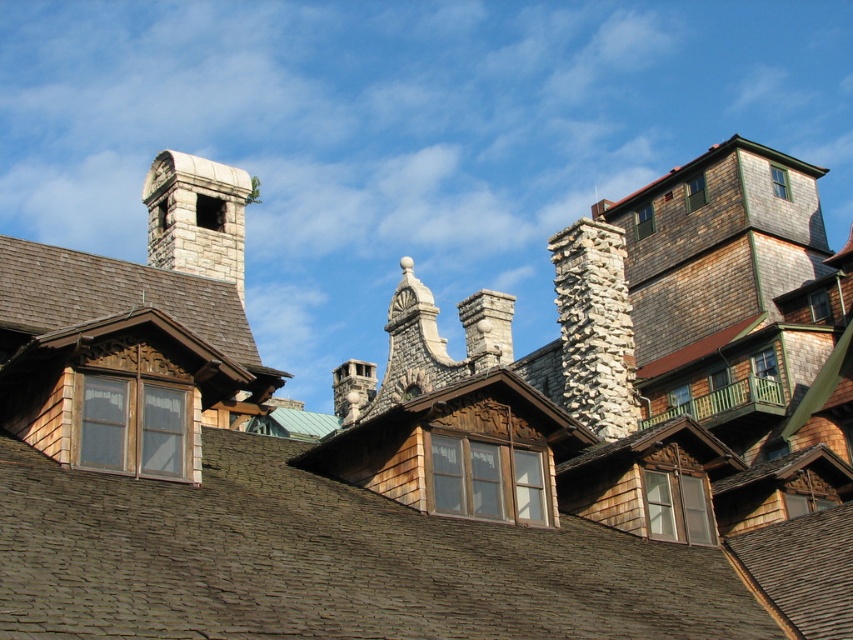
Question: Does stone chimney at center-right have a smaller size compared to stone chimney at upper left?

Choices:
 (A) yes
 (B) no

Answer: (B)

Question: Which object appears farthest from the camera in this image?

Choices:
 (A) stone chimney at center-right
 (B) stone chimney at upper left

Answer: (A)

Question: Is stone chimney at center-right below stone chimney at upper left?

Choices:
 (A) yes
 (B) no

Answer: (A)

Question: Observing the image, what is the correct spatial positioning of stone chimney at center-right in reference to stone chimney at upper left?

Choices:
 (A) below
 (B) above

Answer: (A)

Question: Which object is closer to the camera taking this photo?

Choices:
 (A) stone chimney at center-right
 (B) stone chimney at upper left

Answer: (B)